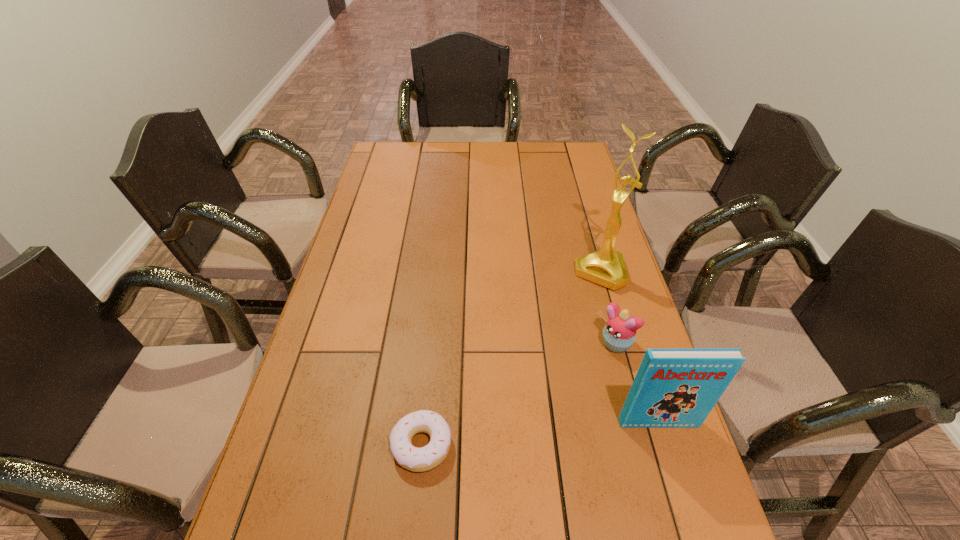
You are a GUI agent. You are given a task and a screenshot of the screen. Output one action in this format:
    pyautogui.click(x=<x>, y=<y>)
    Task: Click on the free region located on the face of the third tallest object
    
    Given the screenshot: What is the action you would take?
    pyautogui.click(x=572, y=383)

Identify the location of free space located 0.230m on the face of the third tallest object. (541, 410).

At what (x,y) coordinates should I click in order to perform the action: click on vacant region located on the front-facing side of the farthest object. Please return your answer as a coordinate pair (x, y). The image size is (960, 540). Looking at the image, I should click on (567, 338).

The width and height of the screenshot is (960, 540). What are the coordinates of `free space located on the front-facing side of the farthest object` in the screenshot? It's located at (558, 357).

Identify the location of free region located on the front-facing side of the farthest object. click(542, 386).

Where is `book located at the right edge`? This screenshot has height=540, width=960. book located at the right edge is located at coordinates (674, 388).

In order to click on cupcake at the right edge in this screenshot , I will do [x=619, y=333].

Where is `award located at the right edge`? Image resolution: width=960 pixels, height=540 pixels. award located at the right edge is located at coordinates (606, 267).

Image resolution: width=960 pixels, height=540 pixels. Identify the location of free space at the far edge of the desktop. (420, 159).

The image size is (960, 540). I want to click on vacant space at the left edge of the desktop, so click(x=376, y=218).